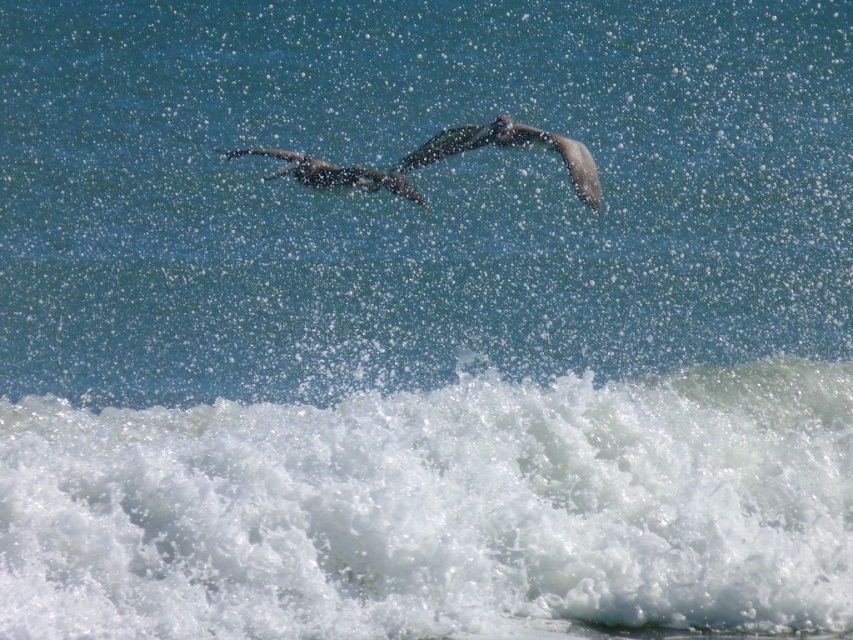
Question: Which point is farther to the camera?

Choices:
 (A) (746, 406)
 (B) (364, 176)

Answer: (B)

Question: Which object is positioned closest to the white frothy wave at lower center?

Choices:
 (A) smooth gray bird at center
 (B) light brown feathered bird at upper center

Answer: (B)

Question: Does white frothy wave at lower center have a greater width compared to smooth gray bird at center?

Choices:
 (A) yes
 (B) no

Answer: (B)

Question: Where is white frothy wave at lower center located in relation to light brown feathered bird at upper center in the image?

Choices:
 (A) below
 (B) above

Answer: (A)

Question: Is light brown feathered bird at upper center to the left of smooth gray bird at center from the viewer's perspective?

Choices:
 (A) yes
 (B) no

Answer: (B)

Question: Which point appears farthest from the camera in this image?

Choices:
 (A) (x=171, y=524)
 (B) (x=509, y=138)

Answer: (B)